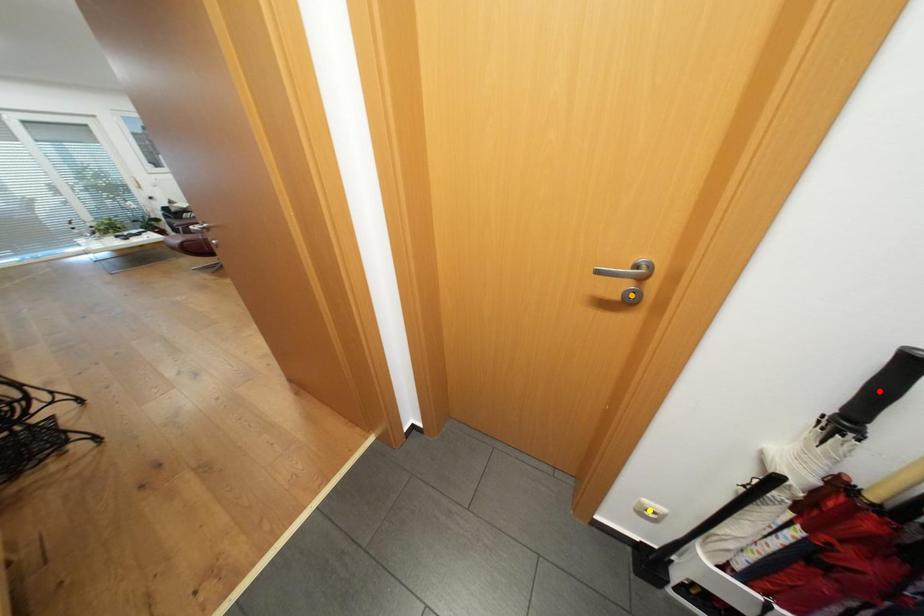
Order these from nearest to farthest:
- red point
- yellow point
- orange point

yellow point → orange point → red point